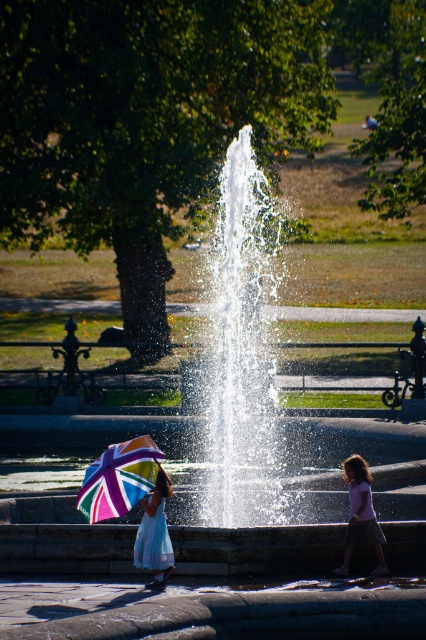
You are a photographer trying to capture both the pink cotton shirt at center and the light blue satin dress at lower left in a single shot. Which clothing item will appear taller in the photo?

The light blue satin dress at lower left will appear taller in the photo because it is taller than the pink cotton shirt at center.